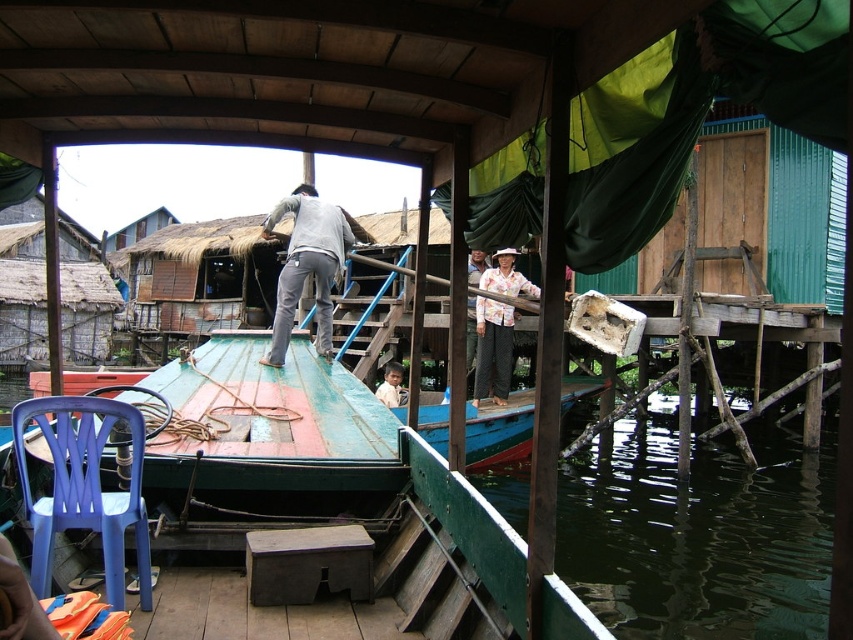
Does blue plastic chair at lower left appear over light brown wooden boat at center?

Correct, blue plastic chair at lower left is located above light brown wooden boat at center.

Can you confirm if blue plastic chair at lower left is wider than light brown wooden boat at center?

Yes.

Is point (123, 506) positioned after point (381, 388)?

No.

What are the coordinates of `blue plastic chair at lower left` in the screenshot? It's located at (83, 486).

Can you confirm if blue plastic chair at lower left is shorter than white cotton shirt at center?

Yes.

Between blue plastic chair at lower left and white cotton shirt at center, which one is positioned lower?

blue plastic chair at lower left is below.

The image size is (853, 640). Find the location of `blue plastic chair at lower left`. blue plastic chair at lower left is located at coordinates (83, 486).

Can you confirm if dark green water at lower right is bigger than blue plastic chair at lower left?

Yes.

Between point (778, 624) and point (33, 536), which one is positioned in front?

Positioned in front is point (33, 536).

Who is more distant from viewer, [641,540] or [59,488]?

Positioned behind is point [641,540].

Locate an element on the screen. This screenshot has width=853, height=640. dark green water at lower right is located at coordinates (698, 536).